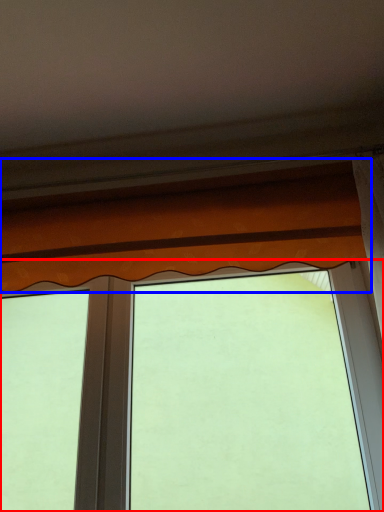
Question: Which object appears closest to the camera in this image, window (highlighted by a red box) or curtain (highlighted by a blue box)?

Choices:
 (A) window
 (B) curtain

Answer: (B)